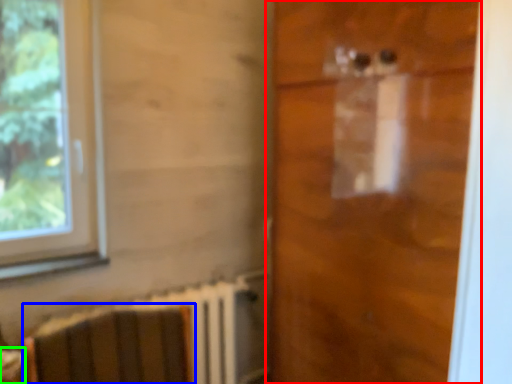
Question: Which object is the closest to the door (highlighted by a red box)? Choose among these: armchair (highlighted by a blue box) or table (highlighted by a green box).

Choices:
 (A) armchair
 (B) table

Answer: (A)